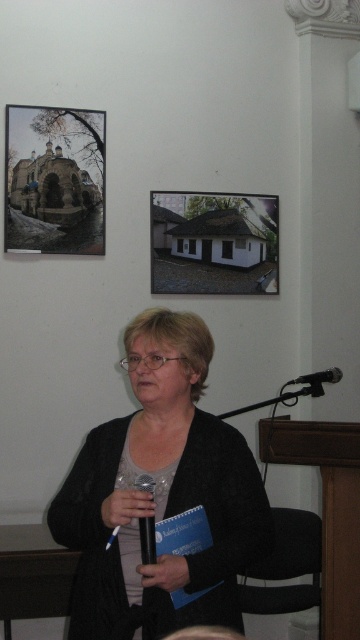
You are an interior designer assessing the wall space in a client room. The client wants to know if the matte black church at upper left and the white matte house at upper center are arranged vertically. Can you confirm if one is taller than the other?

The matte black church at upper left is taller than the white matte house at upper center, so yes, they are arranged vertically with the church being taller.

You are an interior designer planning the layout of a living room. You want to place the matte black church at upper left and the white matte house at upper center on the wall. Based on the scene description, which object is positioned higher on the wall?

The matte black church at upper left is positioned higher on the wall than the white matte house at upper center.